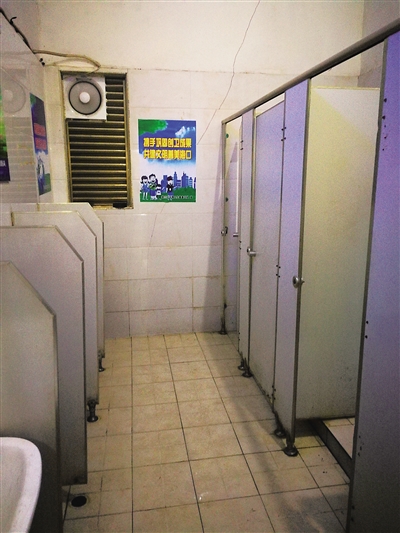
Find the location of `floor`. floor is located at coordinates (184, 444).